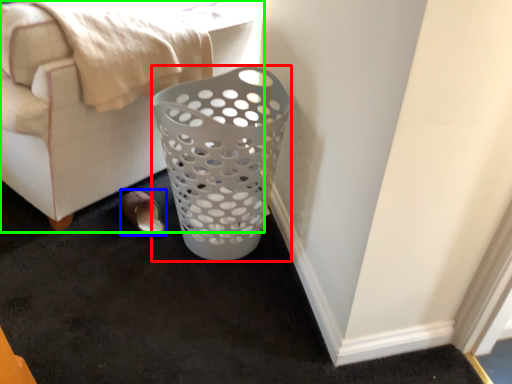
Question: Based on their relative distances, which object is farther from basket (highlighted by a red box)? Choose from footwear (highlighted by a blue box) and furniture (highlighted by a green box).

Choices:
 (A) footwear
 (B) furniture

Answer: (A)